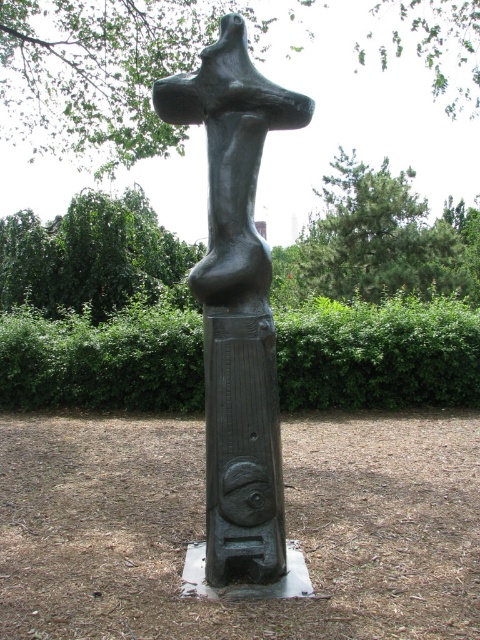
Is green leafy hedge at center wider than bronze statue at center?

Correct, the width of green leafy hedge at center exceeds that of bronze statue at center.

Between point (192, 388) and point (236, 376), which one is positioned in front?

Point (236, 376) is in front.

The image size is (480, 640). What do you see at coordinates (379, 353) in the screenshot? I see `green leafy hedge at center` at bounding box center [379, 353].

This screenshot has width=480, height=640. Identify the location of green leafy hedge at center. (379, 353).

Between point (240, 381) and point (230, 488), which one is positioned behind?

The point (240, 381) is more distant.

Does bronze statue at center have a lesser height compared to green polished stone pole at center?

No, bronze statue at center is not shorter than green polished stone pole at center.

Does point (226, 13) come behind point (265, 580)?

Yes, point (226, 13) is farther from viewer.

The width and height of the screenshot is (480, 640). Identify the location of bronze statue at center. click(x=237, y=307).

Can you confirm if green leafy hedge at center is smaller than green polished stone pole at center?

No, green leafy hedge at center is not smaller than green polished stone pole at center.

Looking at this image, which is above, green leafy hedge at center or green polished stone pole at center?

green leafy hedge at center is above.

At what (x,y) coordinates should I click in order to perform the action: click on green leafy hedge at center. Please return your answer as a coordinate pair (x, y). The height and width of the screenshot is (640, 480). Looking at the image, I should click on (379, 353).

This screenshot has height=640, width=480. What are the coordinates of `green leafy hedge at center` in the screenshot? It's located at (379, 353).